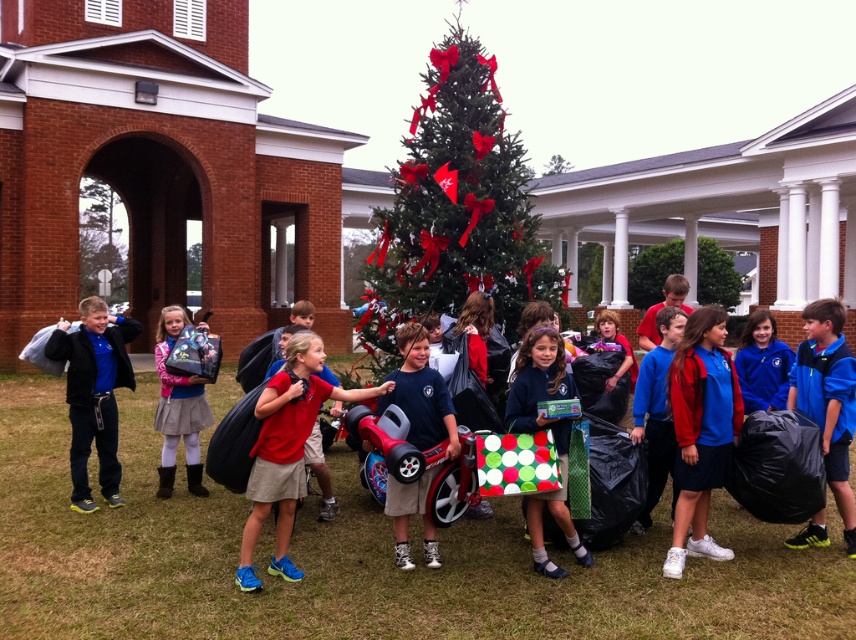
You are a photographer trying to capture a photo of the blue fleece jacket at left and the matte black backpack at center. Since you want both items in the frame, which one should you position closer to the left side of your camera viewfinder?

The blue fleece jacket at left should be positioned closer to the left side of your camera viewfinder because it is already on the left side of the matte black backpack at center.

Based on the scene description, where is the green artificial christmas tree at center located in the image?

The green artificial christmas tree at center is located at point 0.327 in the x coordinate and 0.534 in the y coordinate.

You are a photographer trying to capture a photo of the children in the festive scene. You notice the red matte shirt at center and the blue fabric shirt at center. Which child should you focus on first if you want to capture the one closer to the left side of the frame?

A: The red matte shirt at center is to the left of the blue fabric shirt at center, so focusing on the child wearing the red matte shirt at center first would capture the one closer to the left side of the frame.